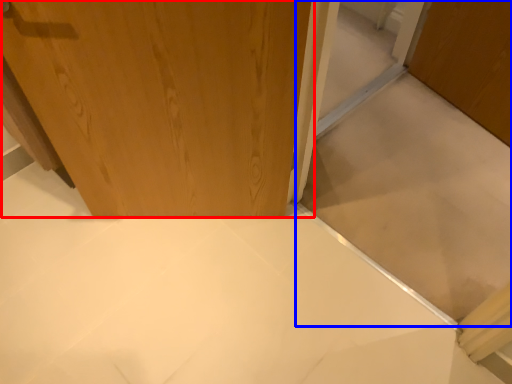
Question: Which point is further to the camera, door (highlighted by a red box) or cabinetry (highlighted by a blue box)?

Choices:
 (A) door
 (B) cabinetry

Answer: (A)